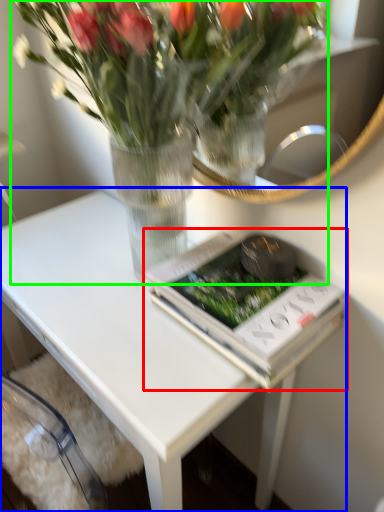
Question: Which object is the farthest from paperback book (highlighted by a red box)? Choose among these: table (highlighted by a blue box) or houseplant (highlighted by a green box).

Choices:
 (A) table
 (B) houseplant

Answer: (B)